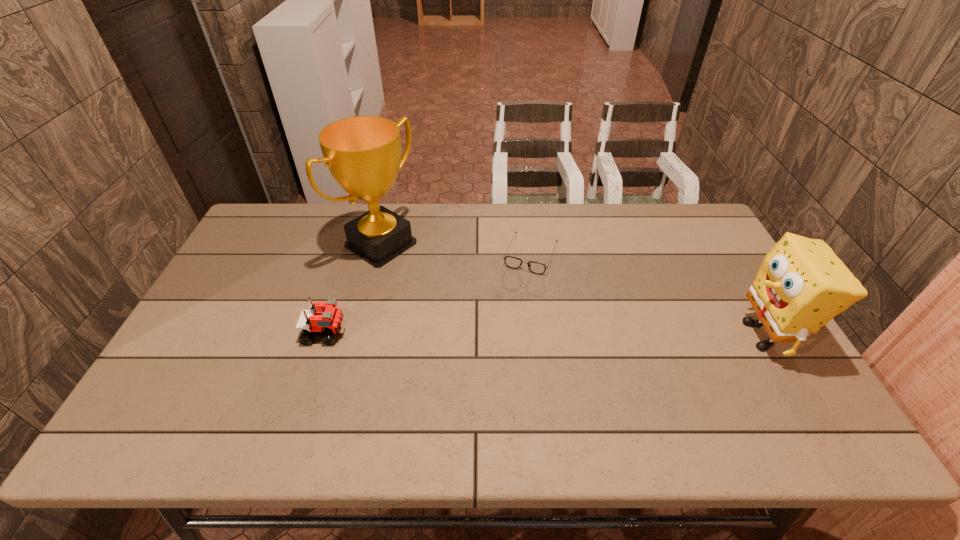
Image resolution: width=960 pixels, height=540 pixels. In order to click on free space at the near edge in this screenshot , I will do `click(232, 384)`.

You are a GUI agent. You are given a task and a screenshot of the screen. Output one action in this format:
    pyautogui.click(x=<x>, y=<y>)
    Task: Click on the vacant region at the right edge of the desktop
    
    Given the screenshot: What is the action you would take?
    pyautogui.click(x=766, y=336)

The width and height of the screenshot is (960, 540). In order to click on free space between the shortest object and the tallest object in this screenshot , I will do `click(456, 250)`.

You are a GUI agent. You are given a task and a screenshot of the screen. Output one action in this format:
    pyautogui.click(x=<x>, y=<y>)
    Task: Click on the vacant space that is in between the Lego and the shortest object
    Image resolution: width=960 pixels, height=540 pixels.
    Given the screenshot: What is the action you would take?
    pyautogui.click(x=428, y=294)

Identify the location of unoccupied area between the Lego and the award. This screenshot has width=960, height=540. (353, 288).

Find the location of a particular element. This screenshot has width=960, height=540. vacant space that is in between the tallest object and the third object from left to right is located at coordinates (456, 250).

Locate an element on the screen. This screenshot has height=540, width=960. vacant area that lies between the second tallest object and the second object from right to left is located at coordinates (647, 295).

Where is `vacant area that lies between the third tallest object and the award`? vacant area that lies between the third tallest object and the award is located at coordinates (353, 288).

Identify the location of free point between the second tallest object and the tallest object. The width and height of the screenshot is (960, 540). (572, 290).

Find the location of a particular element. vacant point located between the Lego and the shortest object is located at coordinates (428, 294).